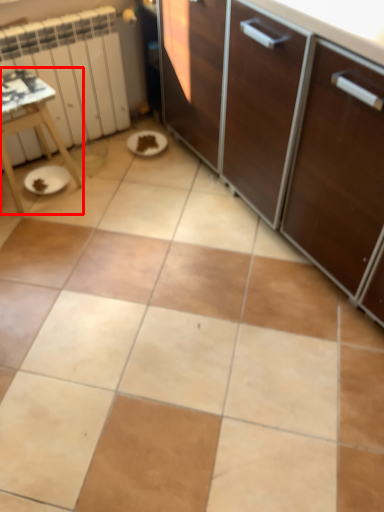
Question: Considering the relative positions of table (annotated by the red box) and radiator in the image provided, where is table (annotated by the red box) located with respect to the staircase?

Choices:
 (A) left
 (B) right

Answer: (A)